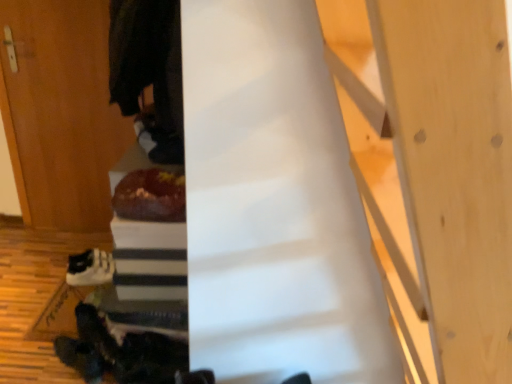
Question: Is dark woolen robe at upper left looking in the opposite direction of white matte sneakers at lower left?

Choices:
 (A) no
 (B) yes

Answer: (A)

Question: Can you confirm if dark woolen robe at upper left is smaller than white matte sneakers at lower left?

Choices:
 (A) yes
 (B) no

Answer: (B)

Question: Is dark woolen robe at upper left closer to the viewer compared to white matte sneakers at lower left?

Choices:
 (A) yes
 (B) no

Answer: (A)

Question: Is white matte sneakers at lower left located within dark woolen robe at upper left?

Choices:
 (A) no
 (B) yes

Answer: (A)

Question: Can you confirm if dark woolen robe at upper left is shorter than white matte sneakers at lower left?

Choices:
 (A) no
 (B) yes

Answer: (A)

Question: Considering the relative positions of wooden door at left and shiny chocolate cake at center in the image provided, is wooden door at left to the left or to the right of shiny chocolate cake at center?

Choices:
 (A) left
 (B) right

Answer: (A)

Question: From a real-world perspective, relative to shiny chocolate cake at center, is wooden door at left vertically above or below?

Choices:
 (A) below
 (B) above

Answer: (A)

Question: From the image's perspective, is wooden door at left positioned above or below shiny chocolate cake at center?

Choices:
 (A) above
 (B) below

Answer: (A)

Question: Looking at their shapes, would you say wooden door at left is wider or thinner than shiny chocolate cake at center?

Choices:
 (A) thin
 (B) wide

Answer: (A)

Question: From a real-world perspective, is wooden door at left above or below dark woolen robe at upper left?

Choices:
 (A) above
 (B) below

Answer: (B)

Question: Is wooden door at left spatially inside dark woolen robe at upper left, or outside of it?

Choices:
 (A) outside
 (B) inside

Answer: (A)

Question: From the image's perspective, relative to dark woolen robe at upper left, is wooden door at left above or below?

Choices:
 (A) below
 (B) above

Answer: (A)

Question: Considering the positions of wooden door at left and dark woolen robe at upper left in the image, is wooden door at left bigger or smaller than dark woolen robe at upper left?

Choices:
 (A) big
 (B) small

Answer: (B)

Question: In terms of size, does shiny chocolate cake at center appear bigger or smaller than wooden door at left?

Choices:
 (A) small
 (B) big

Answer: (A)

Question: Is shiny chocolate cake at center taller or shorter than wooden door at left?

Choices:
 (A) short
 (B) tall

Answer: (A)